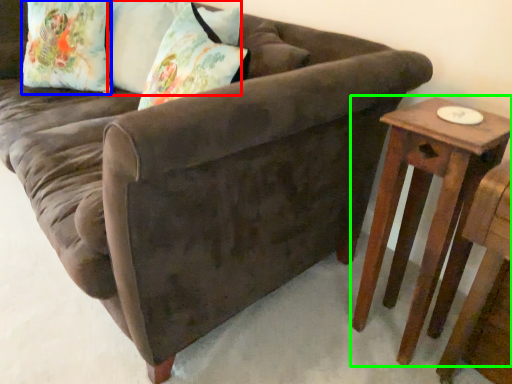
Question: Which is nearer to the pillow (highlighted by a red box)? pillow (highlighted by a blue box) or table (highlighted by a green box).

Choices:
 (A) pillow
 (B) table

Answer: (A)